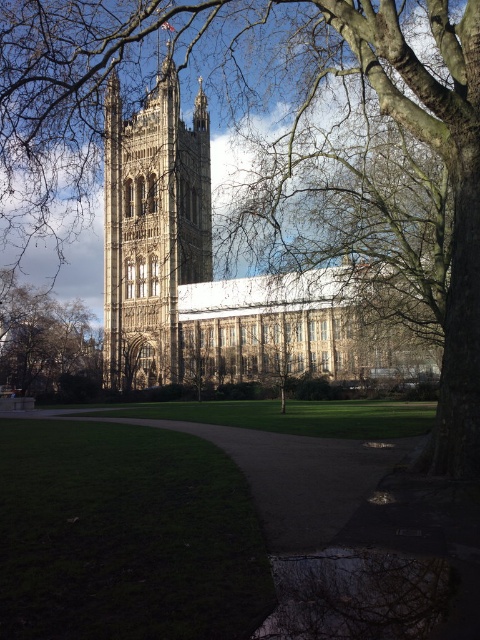
Question: Where is golden stone tower at center located in relation to smooth bark tree at lower left in the image?

Choices:
 (A) left
 (B) right

Answer: (B)

Question: Is golden stone church at center to the right of brown gravel path at center from the viewer's perspective?

Choices:
 (A) yes
 (B) no

Answer: (B)

Question: Among these points, which one is farthest from the camera?

Choices:
 (A) (21, 337)
 (B) (269, 545)
 (C) (137, 125)

Answer: (C)

Question: Which point is farther from the camera taking this photo?

Choices:
 (A) (180, 164)
 (B) (340, 483)
 (C) (2, 353)

Answer: (C)

Question: Which of the following is the closest to the observer?

Choices:
 (A) (172, 77)
 (B) (187, 140)

Answer: (A)

Question: Observing the image, what is the correct spatial positioning of golden stone church at center in reference to golden stone tower at center?

Choices:
 (A) right
 (B) left

Answer: (B)